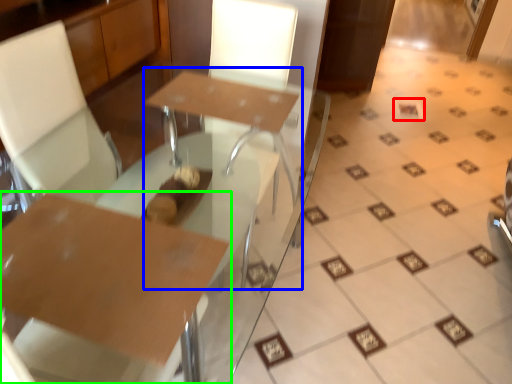
Question: Which is nearer to the square (highlighted by a red box)? round table (highlighted by a blue box) or table (highlighted by a green box).

Choices:
 (A) round table
 (B) table

Answer: (A)